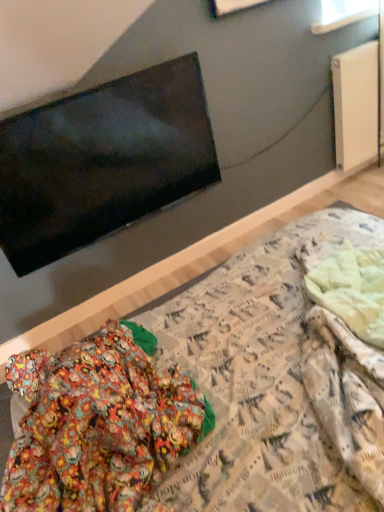
Question: Is patterned fabric bed at center taller or shorter than flat matte black tv at upper left?

Choices:
 (A) tall
 (B) short

Answer: (A)

Question: Is point (205, 439) positioned closer to the camera than point (147, 141)?

Choices:
 (A) farther
 (B) closer

Answer: (B)

Question: Which object is positioned closest to the flat matte black tv at upper left?

Choices:
 (A) white matte radiator at upper right
 (B) patterned fabric bed at center
 (C) transparent glass window at upper right

Answer: (B)

Question: Estimate the real-world distances between objects in this image. Which object is closer to the transparent glass window at upper right?

Choices:
 (A) patterned fabric bed at center
 (B) flat matte black tv at upper left
 (C) white matte radiator at upper right

Answer: (C)